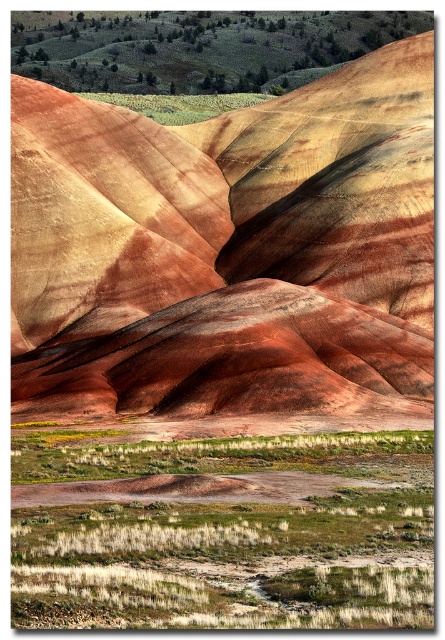
From the picture: You are standing at the edge of the landscape and want to take a photo of the multicolored sedimentary rock at center and the green grass at lower center. Which object will appear closer to the camera in the photo?

The multicolored sedimentary rock at center will appear closer to the camera in the photo because the green grass at lower center is behind it.

You are standing in the landscape and see two points marked in the image. Which point is closer to you, point (52, 246) or point (404, 474)?

Point (52, 246) is closer to you than point (404, 474).